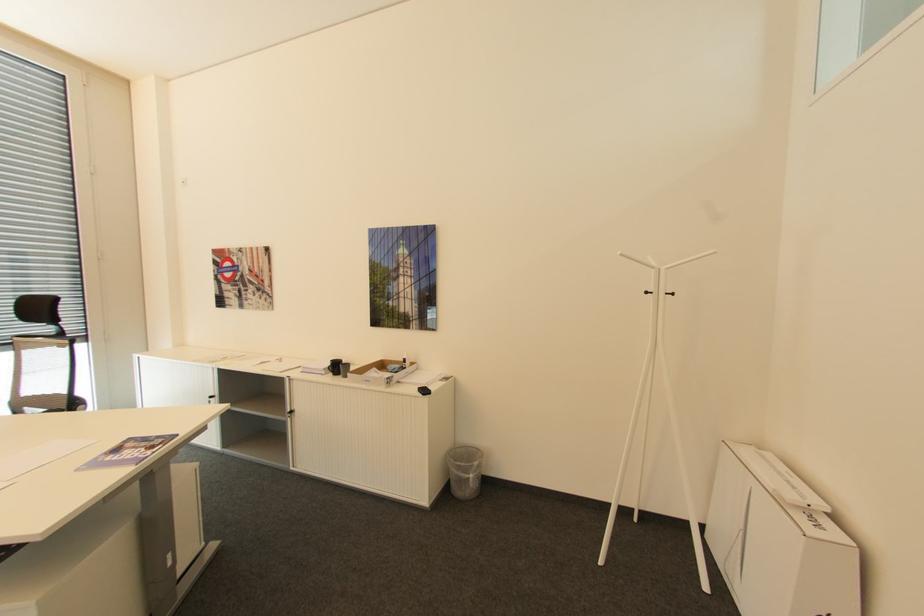
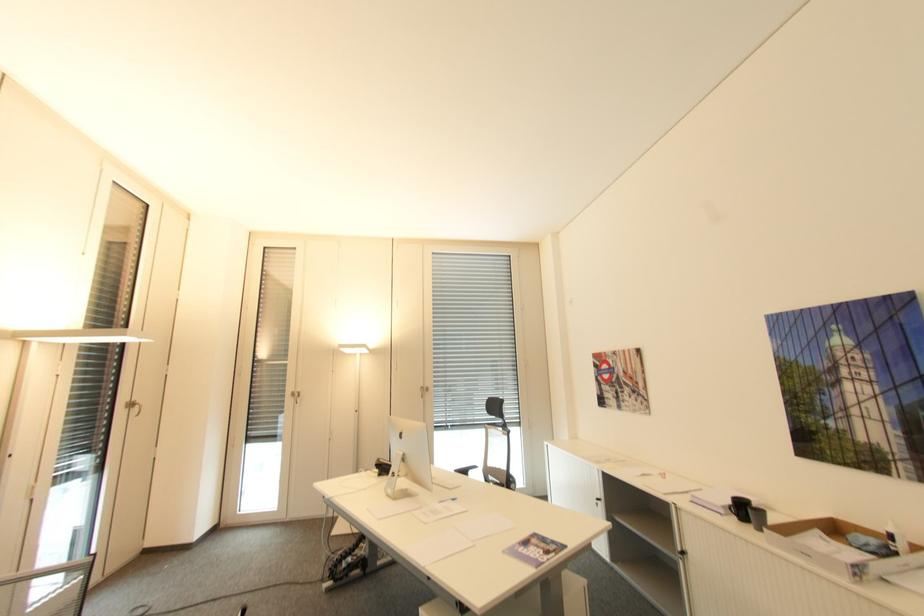
The point at (81, 469) is marked in the first image. Where is the corresponding point in the second image?

(507, 553)